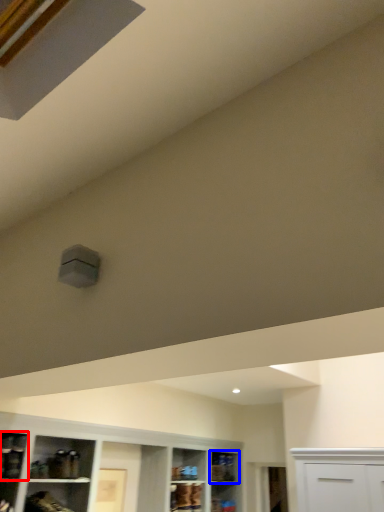
Question: Which of the following is the farthest to the observer, shelf (highlighted by a red box) or shelf (highlighted by a blue box)?

Choices:
 (A) shelf
 (B) shelf

Answer: (B)